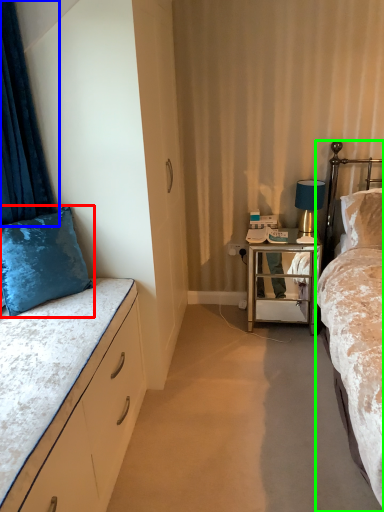
Question: Which object is positioned closest to pillow (highlighted by a red box)? Select from curtain (highlighted by a blue box) and bed (highlighted by a green box).

Choices:
 (A) curtain
 (B) bed

Answer: (A)